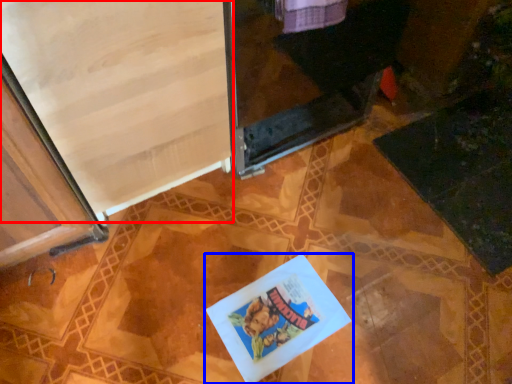
Question: Which of the following is the closest to the observer, screen door (highlighted by a red box) or book (highlighted by a blue box)?

Choices:
 (A) screen door
 (B) book

Answer: (A)